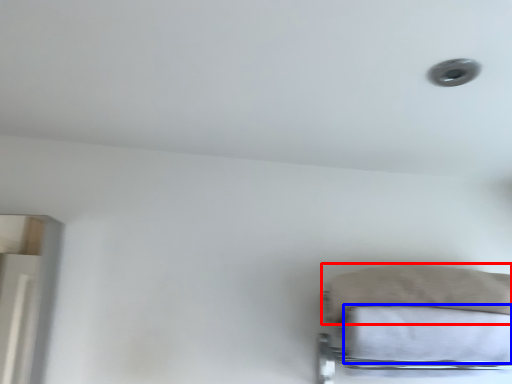
Question: Among these objects, which one is nearest to the camera, pillow (highlighted by a red box) or sheet (highlighted by a blue box)?

Choices:
 (A) pillow
 (B) sheet

Answer: (B)